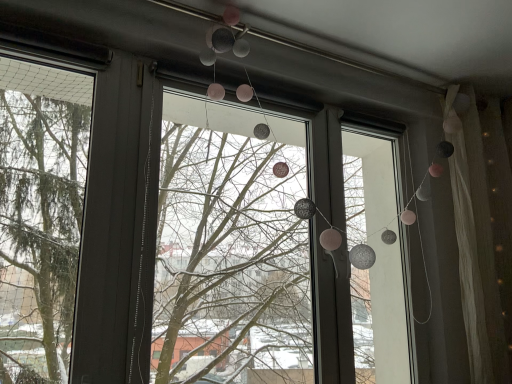
Question: Is translucent white curtain at right wider or thinner than translucent glass window at upper center?

Choices:
 (A) thin
 (B) wide

Answer: (B)

Question: From a real-world perspective, is translucent white curtain at right positioned above or below translucent glass window at upper center?

Choices:
 (A) above
 (B) below

Answer: (A)

Question: From their relative heights in the image, would you say translucent white curtain at right is taller or shorter than translucent glass window at upper center?

Choices:
 (A) tall
 (B) short

Answer: (A)

Question: Looking at the image, does translucent glass window at upper center seem bigger or smaller compared to translucent white curtain at right?

Choices:
 (A) small
 (B) big

Answer: (B)

Question: From a real-world perspective, is translucent glass window at upper center above or below translucent white curtain at right?

Choices:
 (A) above
 (B) below

Answer: (B)

Question: In terms of width, does translucent glass window at upper center look wider or thinner when compared to translucent white curtain at right?

Choices:
 (A) thin
 (B) wide

Answer: (A)

Question: Is point (162, 180) positioned closer to the camera than point (484, 380)?

Choices:
 (A) closer
 (B) farther

Answer: (B)